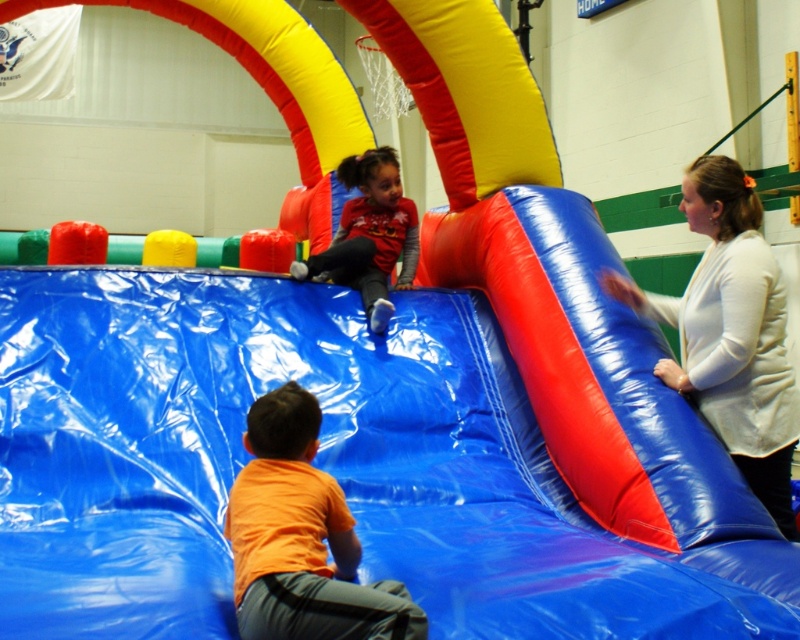
Question: Which object is positioned closest to the orange matte shirt at lower center?

Choices:
 (A) white matte jacket at right
 (B) matte red shirt at upper center

Answer: (A)

Question: Which point is farther to the camera?

Choices:
 (A) (270, 605)
 (B) (370, 196)

Answer: (B)

Question: Does white matte jacket at right lie in front of orange matte shirt at lower center?

Choices:
 (A) yes
 (B) no

Answer: (B)

Question: Where is white matte jacket at right located in relation to matte red shirt at upper center in the image?

Choices:
 (A) above
 (B) below

Answer: (B)

Question: Which point appears farthest from the camera in this image?

Choices:
 (A) (386, 266)
 (B) (690, 376)

Answer: (A)

Question: Considering the relative positions of orange matte shirt at lower center and matte red shirt at upper center in the image provided, where is orange matte shirt at lower center located with respect to matte red shirt at upper center?

Choices:
 (A) below
 (B) above

Answer: (A)